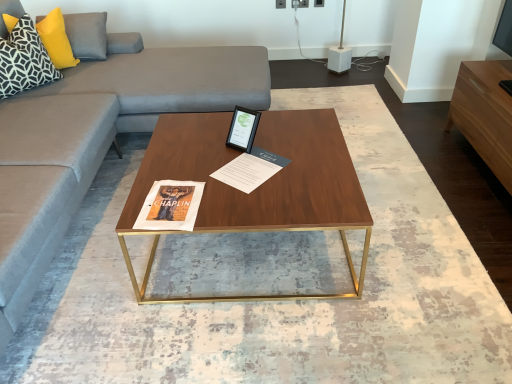
Question: Considering the relative positions of light brown wood entertainment center at right and black and white geometric fabric pillow at upper left, the second pillow from the back, in the image provided, is light brown wood entertainment center at right in front of black and white geometric fabric pillow at upper left, the second pillow from the back,?

Choices:
 (A) no
 (B) yes

Answer: (B)

Question: Can you confirm if light brown wood entertainment center at right is thinner than black and white geometric fabric pillow at upper left, the 1th pillow when ordered from front to back?

Choices:
 (A) yes
 (B) no

Answer: (B)

Question: Is light brown wood entertainment center at right bigger than black and white geometric fabric pillow at upper left, the second pillow from the back?

Choices:
 (A) no
 (B) yes

Answer: (B)

Question: Is light brown wood entertainment center at right further to the viewer compared to black and white geometric fabric pillow at upper left, the second pillow from the back?

Choices:
 (A) no
 (B) yes

Answer: (A)

Question: Is light brown wood entertainment center at right positioned with its back to black and white geometric fabric pillow at upper left, the second pillow from the back?

Choices:
 (A) no
 (B) yes

Answer: (A)

Question: Does light brown wood entertainment center at right appear on the left side of black and white geometric fabric pillow at upper left, the second pillow from the back?

Choices:
 (A) no
 (B) yes

Answer: (A)

Question: Can you see wooden polished coffee table at center touching matte paper magazine at center?

Choices:
 (A) yes
 (B) no

Answer: (B)

Question: Considering the relative sizes of wooden polished coffee table at center and matte paper magazine at center in the image provided, is wooden polished coffee table at center wider than matte paper magazine at center?

Choices:
 (A) no
 (B) yes

Answer: (B)

Question: Could you tell me if wooden polished coffee table at center is facing matte paper magazine at center?

Choices:
 (A) no
 (B) yes

Answer: (A)

Question: Is wooden polished coffee table at center further to the viewer compared to matte paper magazine at center?

Choices:
 (A) no
 (B) yes

Answer: (A)

Question: Can you confirm if wooden polished coffee table at center is smaller than matte paper magazine at center?

Choices:
 (A) yes
 (B) no

Answer: (B)

Question: Does wooden polished coffee table at center have a larger size compared to matte paper magazine at center?

Choices:
 (A) no
 (B) yes

Answer: (B)

Question: Is black and white geometric fabric pillow at upper left, the second pillow from the back, completely or partially inside wooden polished coffee table at center?

Choices:
 (A) no
 (B) yes

Answer: (A)